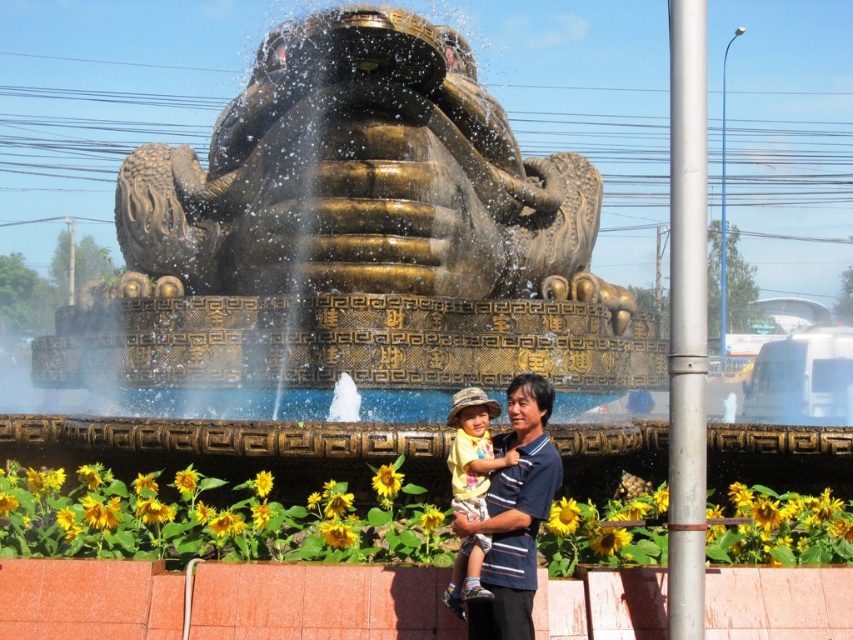
Based on the photo, between gold polished statue at center and yellow cotton shirt at center, which one is positioned higher?

gold polished statue at center

The height and width of the screenshot is (640, 853). Find the location of `gold polished statue at center`. gold polished statue at center is located at coordinates (352, 244).